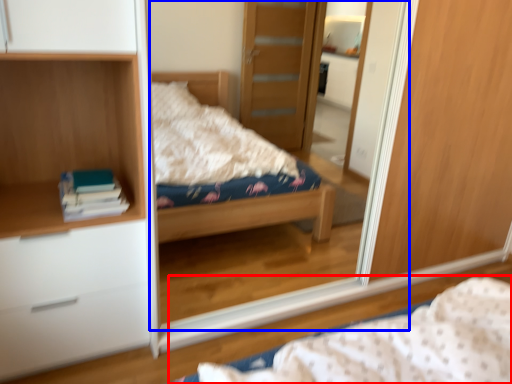
Question: Among these objects, which one is nearest to the camera, bed (highlighted by a red box) or mirror (highlighted by a blue box)?

Choices:
 (A) bed
 (B) mirror

Answer: (A)